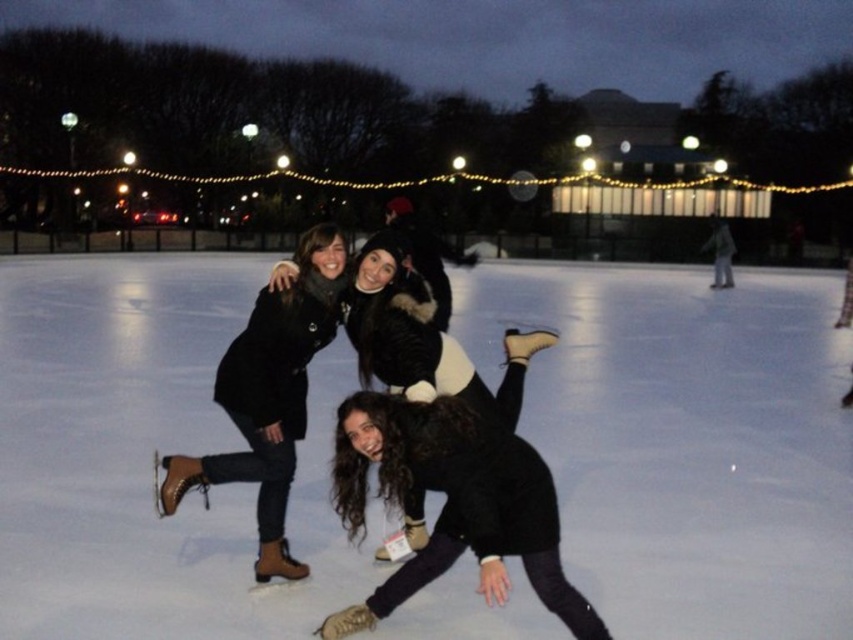
Question: Is white ice skating rink at center wider than black fuzzy jacket at lower center?

Choices:
 (A) no
 (B) yes

Answer: (B)

Question: Can you confirm if black fuzzy jacket at lower center is bigger than matte brown boots at center?

Choices:
 (A) yes
 (B) no

Answer: (B)

Question: Among these points, which one is nearest to the camera?

Choices:
 (A) (315, 330)
 (B) (125, 388)

Answer: (A)

Question: Which point appears farthest from the camera in this image?

Choices:
 (A) (245, 596)
 (B) (485, 509)
 (C) (257, 376)

Answer: (A)

Question: Is black fuzzy jacket at lower center to the right of matte brown boots at center from the viewer's perspective?

Choices:
 (A) yes
 (B) no

Answer: (A)

Question: Which point appears closest to the camera in this image?

Choices:
 (A) (654, 422)
 (B) (335, 234)

Answer: (B)